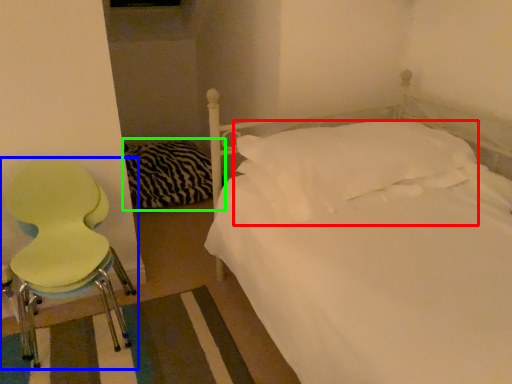
Question: Estimate the real-world distances between objects in this image. Which object is closer to pillow (highlighted by a red box), chair (highlighted by a blue box) or bedding (highlighted by a green box)?

Choices:
 (A) chair
 (B) bedding

Answer: (A)